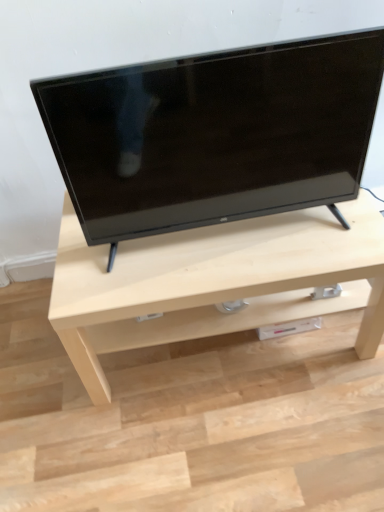
Question: From a real-world perspective, relative to light wood table at center, is black glossy tv at center vertically above or below?

Choices:
 (A) below
 (B) above

Answer: (B)

Question: From the image's perspective, is black glossy tv at center above or below light wood table at center?

Choices:
 (A) below
 (B) above

Answer: (B)

Question: In terms of size, does black glossy tv at center appear bigger or smaller than light wood table at center?

Choices:
 (A) small
 (B) big

Answer: (A)

Question: Is point (170, 295) positioned closer to the camera than point (130, 104)?

Choices:
 (A) farther
 (B) closer

Answer: (A)

Question: Considering their positions, is light wood table at center located in front of or behind black glossy tv at center?

Choices:
 (A) front
 (B) behind

Answer: (B)

Question: Is light wood table at center to the left or to the right of black glossy tv at center in the image?

Choices:
 (A) left
 (B) right

Answer: (B)

Question: Is light wood table at center bigger or smaller than black glossy tv at center?

Choices:
 (A) small
 (B) big

Answer: (B)